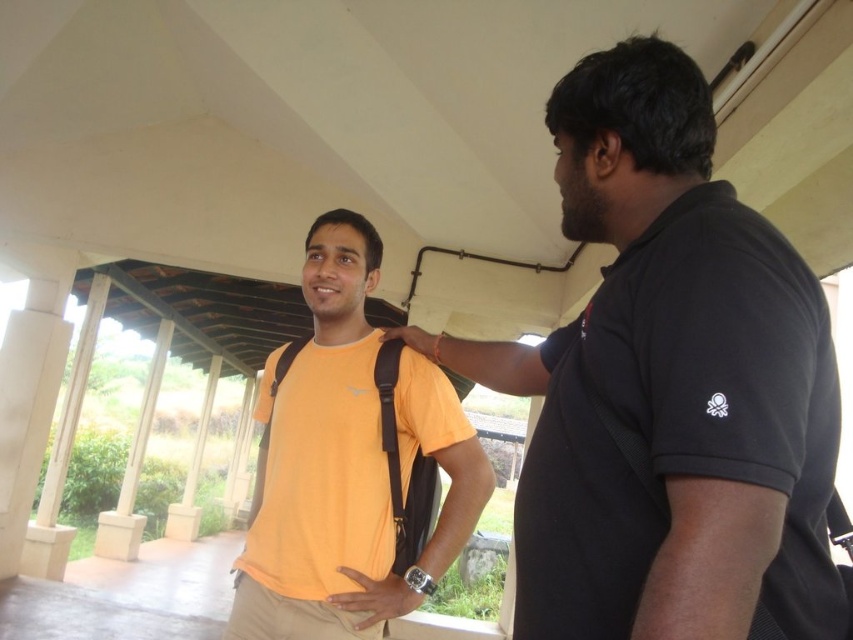
Between point (773, 445) and point (251, 608), which one is positioned behind?

Positioned behind is point (251, 608).

Is black matte shirt at upper right to the right of orange matte t-shirt at center from the viewer's perspective?

Yes, black matte shirt at upper right is to the right of orange matte t-shirt at center.

Locate an element on the screen. This screenshot has width=853, height=640. black matte shirt at upper right is located at coordinates (x=669, y=385).

At what (x,y) coordinates should I click in order to perform the action: click on black matte shirt at upper right. Please return your answer as a coordinate pair (x, y). Looking at the image, I should click on (669, 385).